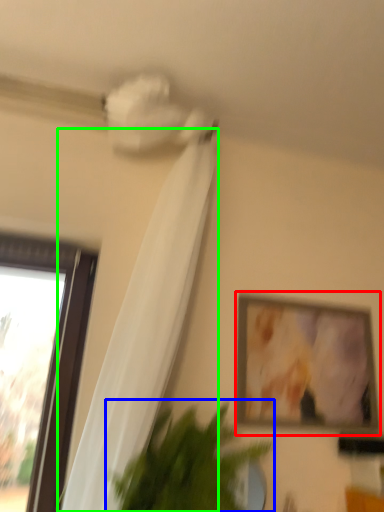
Question: Considering the real-world distances, which object is closest to picture frame (highlighted by a red box)? houseplant (highlighted by a blue box) or curtain (highlighted by a green box).

Choices:
 (A) houseplant
 (B) curtain

Answer: (A)